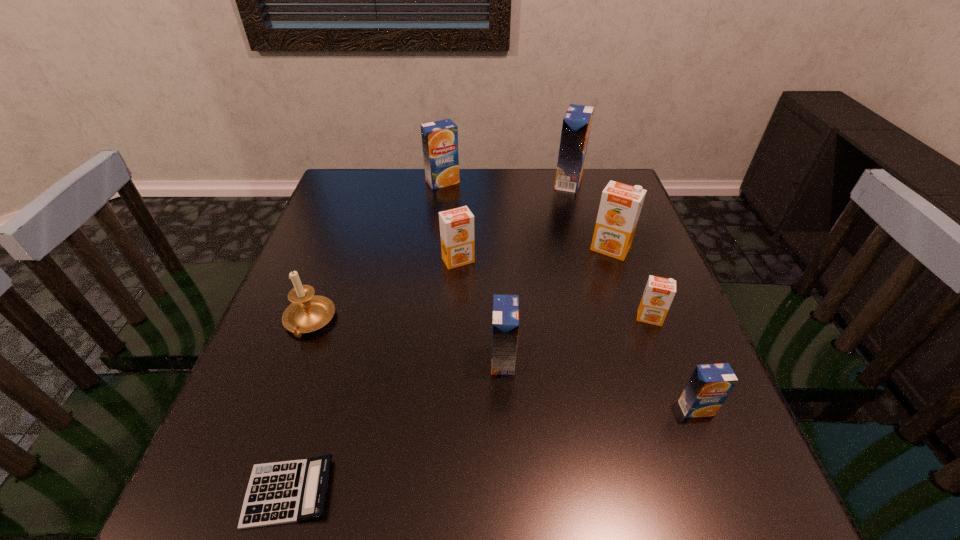
Identify the location of the biggest blue orange_juice. (576, 125).

Where is `the tallest object`? the tallest object is located at coordinates (576, 125).

This screenshot has height=540, width=960. In order to click on the leftmost blue orange_juice in this screenshot , I will do `click(440, 138)`.

I want to click on the biggest orange orange juice, so click(x=620, y=206).

Identify the location of the second biggest orange orange juice. This screenshot has height=540, width=960. (456, 225).

Locate an element on the screen. The image size is (960, 540). the third farthest blue orange_juice is located at coordinates (505, 328).

Identify the location of the fifth object from right to left. The height and width of the screenshot is (540, 960). (505, 328).

I want to click on beige candle holder, so click(x=308, y=312).

Where is `the nearest blue orange_juice`? Image resolution: width=960 pixels, height=540 pixels. the nearest blue orange_juice is located at coordinates (708, 387).

Where is `the second nearest object`? the second nearest object is located at coordinates (708, 387).